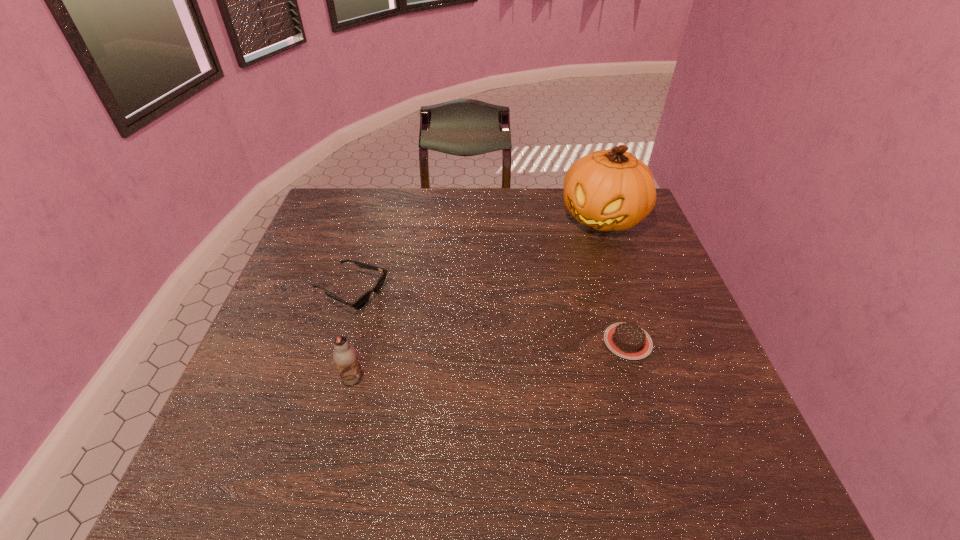
Where is `free region that satisfies the following two spatial constraints: 1. on the back side of the chocolate milk; 2. on the right side of the pumpkin`? This screenshot has height=540, width=960. free region that satisfies the following two spatial constraints: 1. on the back side of the chocolate milk; 2. on the right side of the pumpkin is located at coordinates (393, 217).